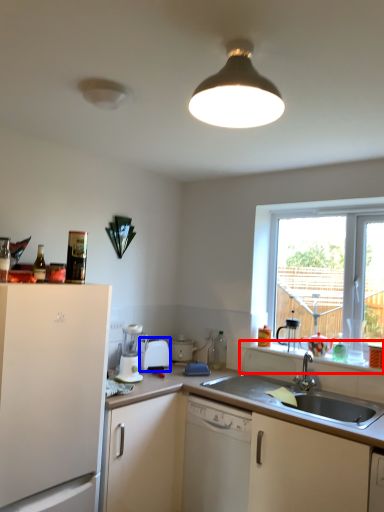
Question: Which object appears farthest to the camera in this image, window sill (highlighted by a red box) or appliance (highlighted by a blue box)?

Choices:
 (A) window sill
 (B) appliance

Answer: (B)